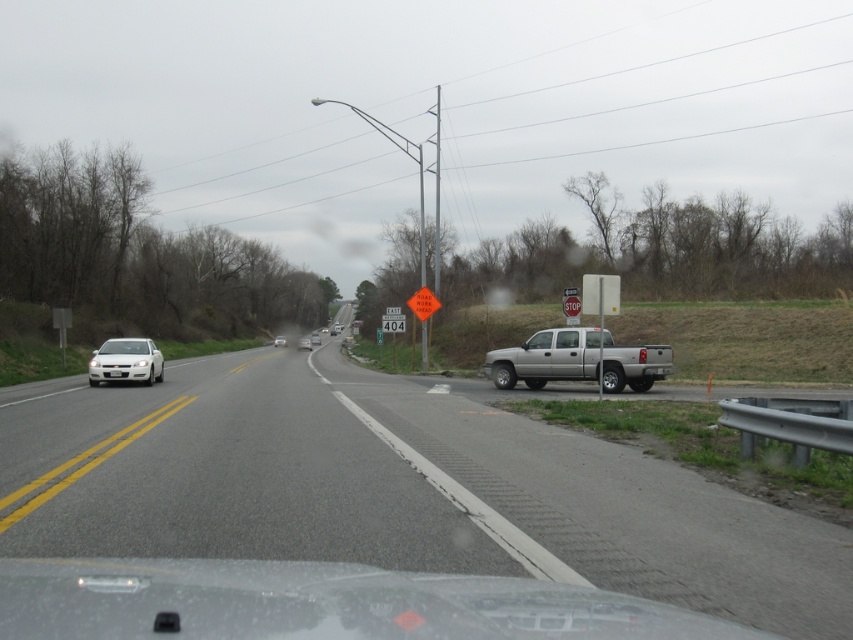
Question: Is silver metallic sedan at center positioned behind white glossy sedan at center?

Choices:
 (A) no
 (B) yes

Answer: (B)

Question: Does white matte sedan at left appear on the right side of white glossy windshield at left?

Choices:
 (A) yes
 (B) no

Answer: (A)

Question: Does white matte sedan at left have a smaller size compared to white glossy sedan at center?

Choices:
 (A) yes
 (B) no

Answer: (B)

Question: Among these objects, which one is farthest from the camera?

Choices:
 (A) silver metallic sedan at center
 (B) gray asphalt road at center
 (C) white glossy windshield at left

Answer: (A)

Question: Which object is the closest to the white matte sedan at center?

Choices:
 (A) green reflective road sign at center
 (B) silver metallic truck at right
 (C) white matte sedan at left

Answer: (C)

Question: Which of the following is the farthest from the observer?

Choices:
 (A) clear glass windshield at right
 (B) green reflective road sign at center
 (C) white glossy windshield at left

Answer: (B)